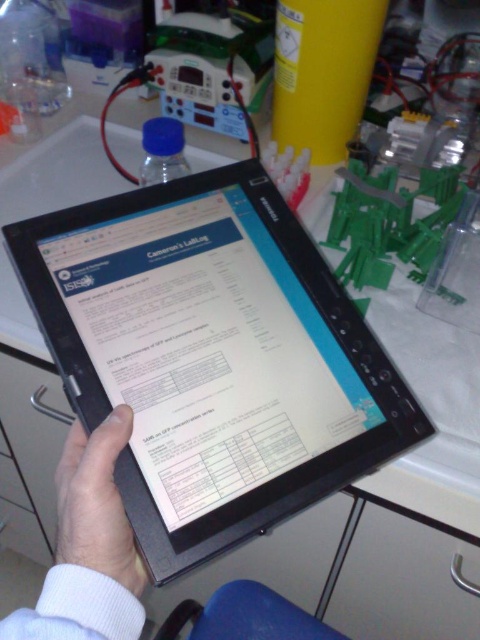
Question: Is black plastic tablet at center to the right of matte black drawer at lower left from the viewer's perspective?

Choices:
 (A) yes
 (B) no

Answer: (A)

Question: Considering the real-world distances, which object is closest to the matte black drawer at lower left?

Choices:
 (A) black plastic tablet at center
 (B) white matte skin at center

Answer: (A)

Question: Is black plastic tablet at center further to camera compared to matte black drawer at lower left?

Choices:
 (A) yes
 (B) no

Answer: (B)

Question: Which of these objects is positioned farthest from the white matte skin at center?

Choices:
 (A) matte black drawer at lower left
 (B) black plastic tablet at center

Answer: (A)

Question: Does white matte skin at center have a smaller size compared to matte black drawer at lower left?

Choices:
 (A) yes
 (B) no

Answer: (A)

Question: Which object is the closest to the black plastic tablet at center?

Choices:
 (A) matte black drawer at lower left
 (B) white matte skin at center

Answer: (B)